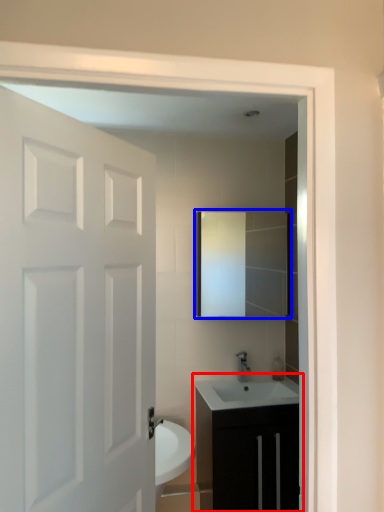
Question: Which point is further to the camera, bathroom cabinet (highlighted by a red box) or mirror (highlighted by a blue box)?

Choices:
 (A) bathroom cabinet
 (B) mirror

Answer: (B)